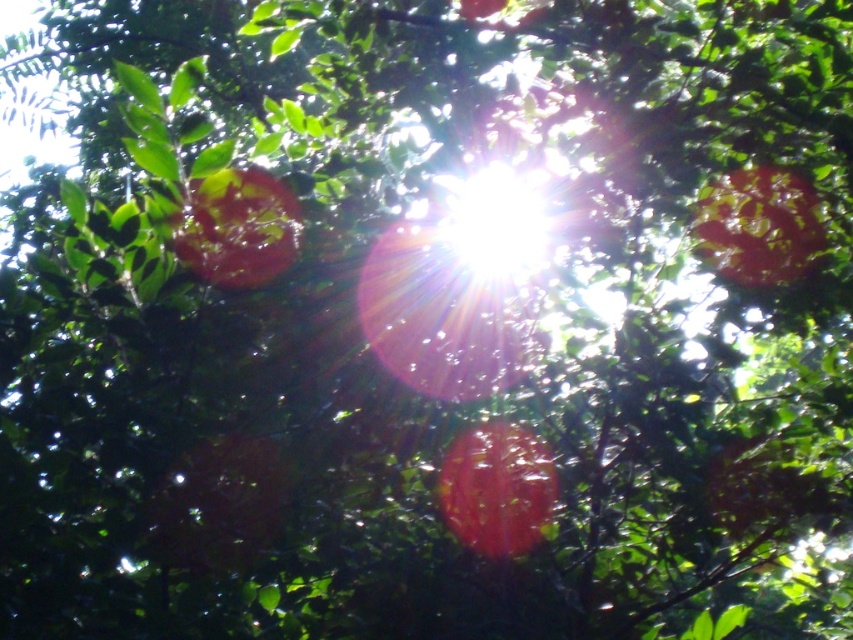
You are taking a photo of the scene and want to focus on both point (762, 184) and point (238, 220). Which point should you focus on first to ensure both are in focus?

You should focus on point (238, 220) first because it is closer to the camera than point (762, 184). By focusing on the closer point, the farther point will also be within the depth of field.

You are an archer standing at the center of the scene aiming at a target. The sun is directly in your line of sight, and you want to avoid sunlight glare while shooting at the glossy red apple at upper right. Based on the coordinates provided, can you determine if the sun is blocking your direct line of sight to the apple?

The glossy red apple at upper right is located at coordinates point (758, 225). Since the sun is positioned at the center of the scene, its coordinates would be approximately (426, 320). The coordinates of the apple are closer to the upper right corner than the center, meaning the sun is not directly in the line of sight to the apple. Therefore, the sun is not blocking the direct path.